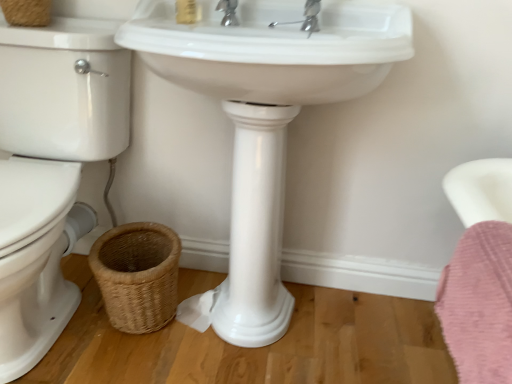
Question: Looking at their shapes, would you say chrome metallic faucet at upper center is wider or thinner than woven natural basket at lower left, which is the 1th basket from right to left?

Choices:
 (A) wide
 (B) thin

Answer: (B)

Question: Is chrome metallic faucet at upper center in front of or behind woven natural basket at lower left, which is the 1th basket from right to left, in the image?

Choices:
 (A) front
 (B) behind

Answer: (A)

Question: Estimate the real-world distances between objects in this image. Which object is farther from the woven brown basket at upper left, arranged as the 2th basket when ordered from the bottom?

Choices:
 (A) pink fluffy bath towel at lower right
 (B) woven natural basket at lower left, the second basket positioned from the top
 (C) matte gold soap at upper center
 (D) white glossy toilet bowl at left
 (E) white glossy sink at center

Answer: (A)

Question: Which is farther from the woven natural basket at lower left, which is the 2th basket in left-to-right order?

Choices:
 (A) white glossy toilet bowl at left
 (B) pink fluffy bath towel at lower right
 (C) woven brown basket at upper left, which is the first basket in left-to-right order
 (D) polished chrome faucet at upper center
 (E) matte gold soap at upper center

Answer: (D)